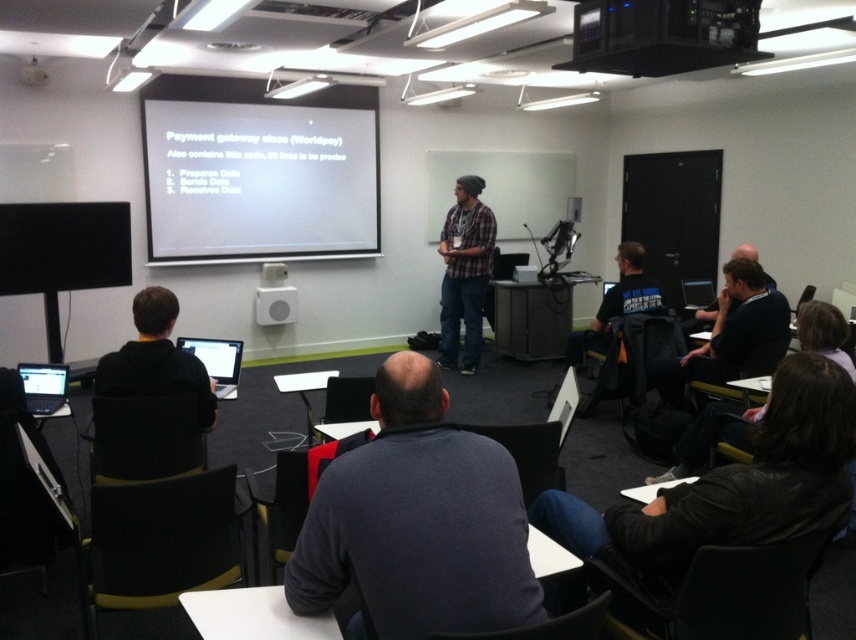
Question: Can you confirm if dark gray sweater at center is positioned above black leather jacket at lower right?

Choices:
 (A) yes
 (B) no

Answer: (A)

Question: Which of the following is the closest to the observer?

Choices:
 (A) (48, 364)
 (B) (613, 564)

Answer: (B)

Question: Is black leather jacket at lower right in front of matte black laptop at lower left?

Choices:
 (A) no
 (B) yes

Answer: (B)

Question: Which object is positioned closest to the plaid fabric shirt at center?

Choices:
 (A) black hoodie at left
 (B) white matte projector screen at upper center

Answer: (B)

Question: Which point is farther to the camera?

Choices:
 (A) (25, 77)
 (B) (548, 502)
 (C) (33, 365)

Answer: (A)

Question: Is dark gray sweater at center to the right of white plastic projector at upper left from the viewer's perspective?

Choices:
 (A) yes
 (B) no

Answer: (A)